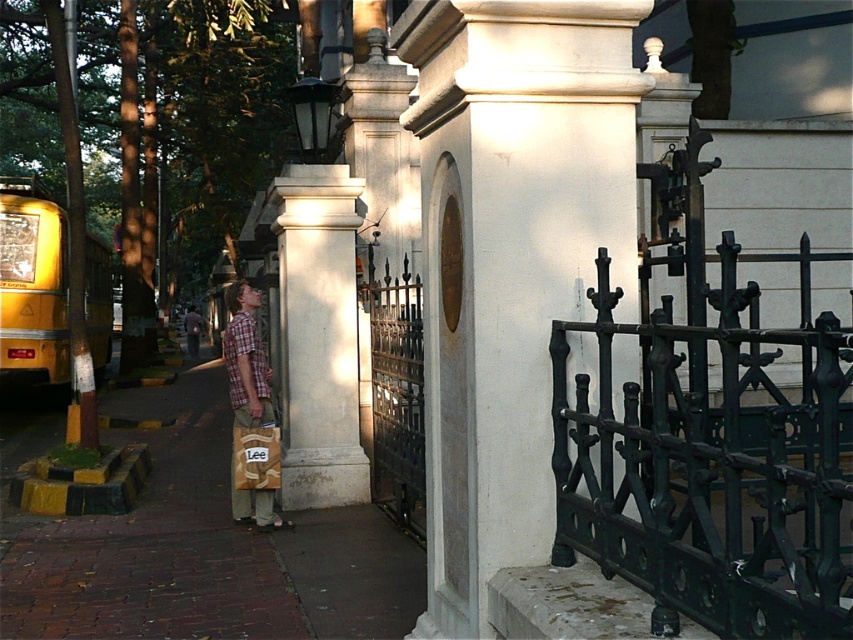
Question: Is green wrought iron gate at center bigger than white polished stone column at center?

Choices:
 (A) yes
 (B) no

Answer: (A)

Question: From the image, what is the correct spatial relationship of white stone pillar at center in relation to yellow metallic school bus at left?

Choices:
 (A) right
 (B) left

Answer: (A)

Question: Can you confirm if brick pavement at lower left is bigger than white polished stone column at center?

Choices:
 (A) no
 (B) yes

Answer: (B)

Question: Among these points, which one is farthest from the camera?

Choices:
 (A) (459, 515)
 (B) (819, 490)

Answer: (A)

Question: Which of the following is the closest to the observer?

Choices:
 (A) (105, 269)
 (B) (560, 77)

Answer: (B)

Question: Which object is positioned closest to the green wrought iron gate at center?

Choices:
 (A) white polished stone column at center
 (B) yellow metallic school bus at left
 (C) brick pavement at lower left
 (D) white stone pillar at center

Answer: (D)